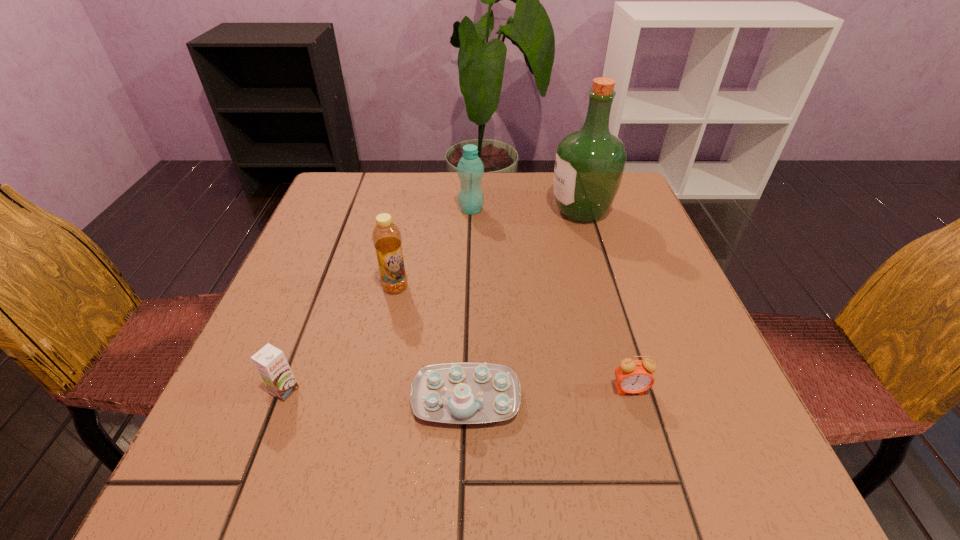
Locate an element on the screen. vacant point located between the tallest object and the fifth tallest object is located at coordinates (606, 300).

You are a GUI agent. You are given a task and a screenshot of the screen. Output one action in this format:
    pyautogui.click(x=<x>, y=<y>)
    Task: Click on the free space that is in between the shortest object and the chocolate milk
    Image resolution: width=960 pixels, height=540 pixels.
    Given the screenshot: What is the action you would take?
    pyautogui.click(x=375, y=394)

The width and height of the screenshot is (960, 540). Identify the location of empty location between the tallest object and the shortest object. (523, 305).

Image resolution: width=960 pixels, height=540 pixels. What are the coordinates of `free space between the liquor and the nearer bottle` in the screenshot? It's located at (488, 249).

You are a GUI agent. You are given a task and a screenshot of the screen. Output one action in this format:
    pyautogui.click(x=<x>, y=<y>)
    Task: Click on the object that ranks as the second closest to the chocolate milk
    The image size is (960, 540).
    Given the screenshot: What is the action you would take?
    pyautogui.click(x=386, y=236)

Locate an element on the screen. the second closest object to the chinaware is located at coordinates (386, 236).

What are the coordinates of `blank space that satisfies the following two spatial constraints: 1. on the back side of the chinaware; 2. on the left side of the right bottle` in the screenshot? It's located at (471, 210).

The image size is (960, 540). I want to click on free point that satisfies the following two spatial constraints: 1. on the front-facing side of the tallest object; 2. on the front side of the chocolate milk, so click(x=636, y=390).

The width and height of the screenshot is (960, 540). I want to click on free region that satisfies the following two spatial constraints: 1. on the back side of the chocolate milk; 2. on the left side of the fifth object from right to left, so click(324, 287).